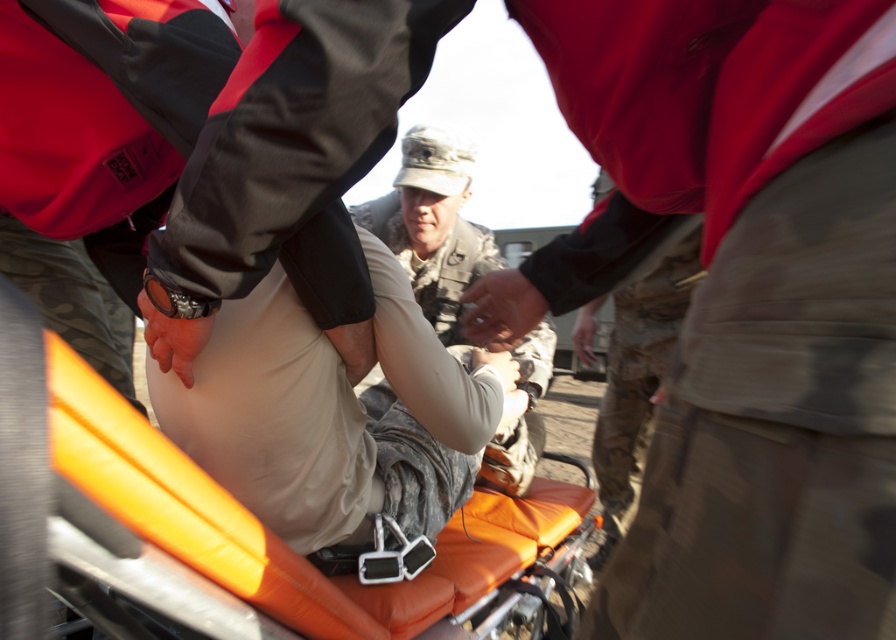
Based on the coordinates provided, what object is located at point (274, 536) in the scene?

The point (274, 536) corresponds to the orange fabric stretcher at center.

You are a medical drone operator trying to deliver a medical kit to the orange fabric stretcher at center. However, there is a camouflage uniform at center in the way. Can you fly the drone directly to the stretcher without going around the uniform?

The orange fabric stretcher at center is in front of the camouflage uniform at center, so the drone can fly directly to the stretcher without needing to go around the uniform since it is already positioned in front.

You are a medical team member looking at the scene. You need to access the camouflage uniform at center for a medical checkup. Is the orange fabric stretcher at center blocking your direct access to it?

The orange fabric stretcher at center is located below the camouflage uniform at center, so it is blocking direct access to the camouflage uniform at center.